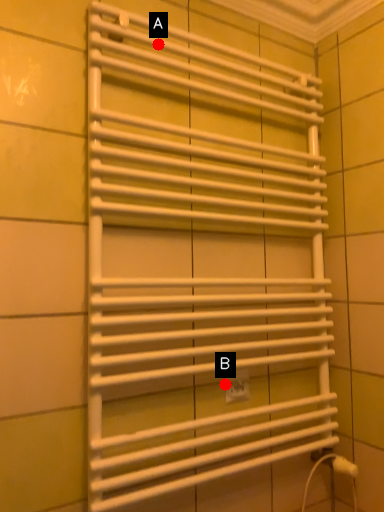
Question: Two points are circled on the image, labeled by A and B beside each circle. Which of the following is the farthest from the observer?

Choices:
 (A) A is further
 (B) B is further

Answer: (B)